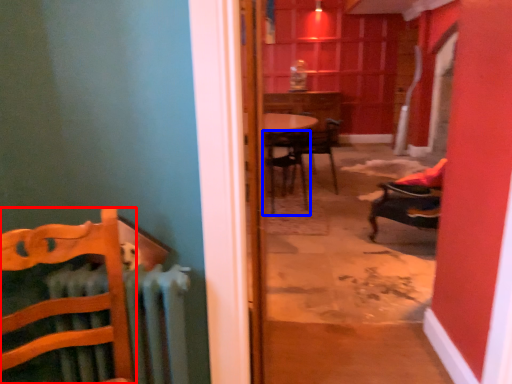
Question: Among these objects, which one is farthest to the camera, chair (highlighted by a red box) or chair (highlighted by a blue box)?

Choices:
 (A) chair
 (B) chair

Answer: (B)